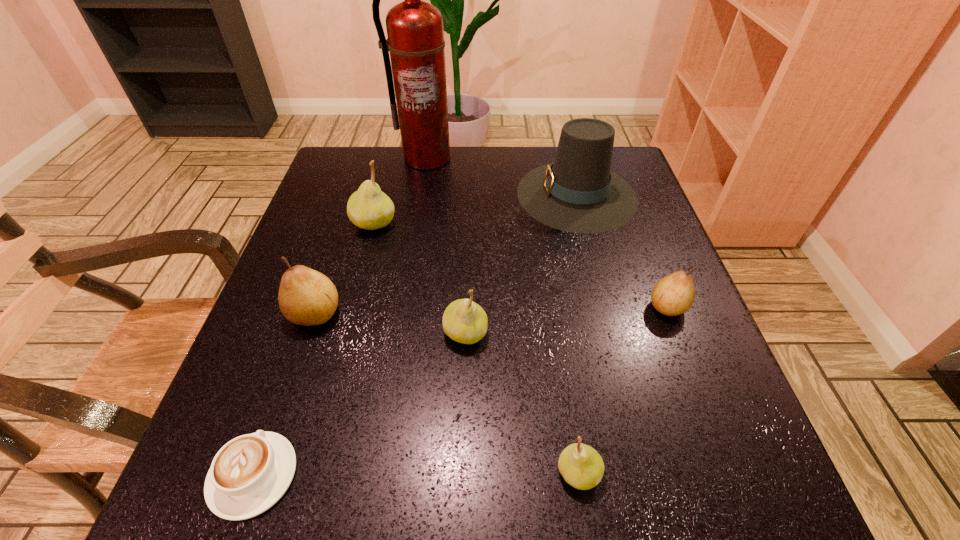
Locate an element on the screen. The width and height of the screenshot is (960, 540). vacant area that lies between the gray hat and the nearest green pear is located at coordinates (578, 334).

You are a GUI agent. You are given a task and a screenshot of the screen. Output one action in this format:
    pyautogui.click(x=<x>, y=<y>)
    Task: Click on the object that ranks as the third closest to the farthest pear
    This screenshot has height=540, width=960.
    Given the screenshot: What is the action you would take?
    pyautogui.click(x=464, y=321)

Locate an element on the screen. The image size is (960, 540). object that ranks as the fifth closest to the fire extinguisher is located at coordinates (672, 295).

Identify which pear is the fourth closest to the third pear from right to left. Please provide its 2D coordinates. Your answer should be formatted as a tuple, i.e. [(x, y)], where the tuple contains the x and y coordinates of a point satisfying the conditions above.

[(672, 295)]

Point out which pear is positioned as the fourth nearest to the fire extinguisher. Please provide its 2D coordinates. Your answer should be formatted as a tuple, i.e. [(x, y)], where the tuple contains the x and y coordinates of a point satisfying the conditions above.

[(672, 295)]

The image size is (960, 540). Identify the location of green pear that can be found as the third closest to the red fire extinguisher. (581, 466).

Image resolution: width=960 pixels, height=540 pixels. I want to click on green pear that can be found as the closest to the fourth pear from left to right, so click(x=464, y=321).

Where is `blank space that satisfies the following two spatial constraints: 1. with the handle on the right side of the right brown pear; 2. on the left side of the cappuccino`? This screenshot has height=540, width=960. blank space that satisfies the following two spatial constraints: 1. with the handle on the right side of the right brown pear; 2. on the left side of the cappuccino is located at coordinates (311, 307).

You are a GUI agent. You are given a task and a screenshot of the screen. Output one action in this format:
    pyautogui.click(x=<x>, y=<y>)
    Task: Click on the free region that satisfies the following two spatial constraints: 1. on the side of the smaller brown pear with the handle and hose; 2. on the left side of the red fire extinguisher
    The image size is (960, 540).
    Given the screenshot: What is the action you would take?
    [402, 307]

Find the location of a particular element. The width and height of the screenshot is (960, 540). free location that satisfies the following two spatial constraints: 1. on the side of the fire extinguisher with the handle and hose; 2. on the right side of the smallest green pear is located at coordinates (376, 473).